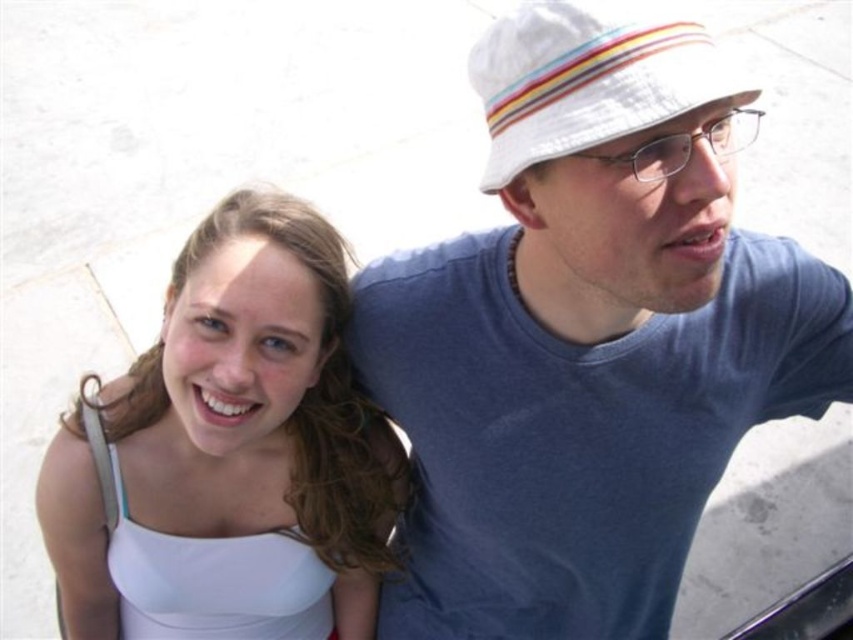
Based on the photo, how distant is white cotton shirt at upper right from clear plastic glasses at upper right?

The distance of white cotton shirt at upper right from clear plastic glasses at upper right is 9.61 feet.

Between point (669, 193) and point (660, 147), which one is positioned in front?

Point (660, 147)

Between point (720, 358) and point (686, 131), which one is positioned in front?

Positioned in front is point (686, 131).

Where is `white cotton shirt at upper right`? Image resolution: width=853 pixels, height=640 pixels. white cotton shirt at upper right is located at coordinates (587, 339).

Does white striped fabric hat at upper right have a larger size compared to clear plastic glasses at upper right?

Incorrect, white striped fabric hat at upper right is not larger than clear plastic glasses at upper right.

Is point (724, 61) farther from viewer compared to point (746, 125)?

No, (724, 61) is in front of (746, 125).

Locate an element on the screen. The width and height of the screenshot is (853, 640). white striped fabric hat at upper right is located at coordinates (589, 80).

Between point (177, 417) and point (549, 29), which one is positioned in front?

Point (549, 29) is more forward.

Is white matte tank top at left taller than white striped fabric hat at upper right?

Yes.

Describe the element at coordinates (260, 403) in the screenshot. The height and width of the screenshot is (640, 853). I see `white matte tank top at left` at that location.

I want to click on white matte tank top at left, so click(x=260, y=403).